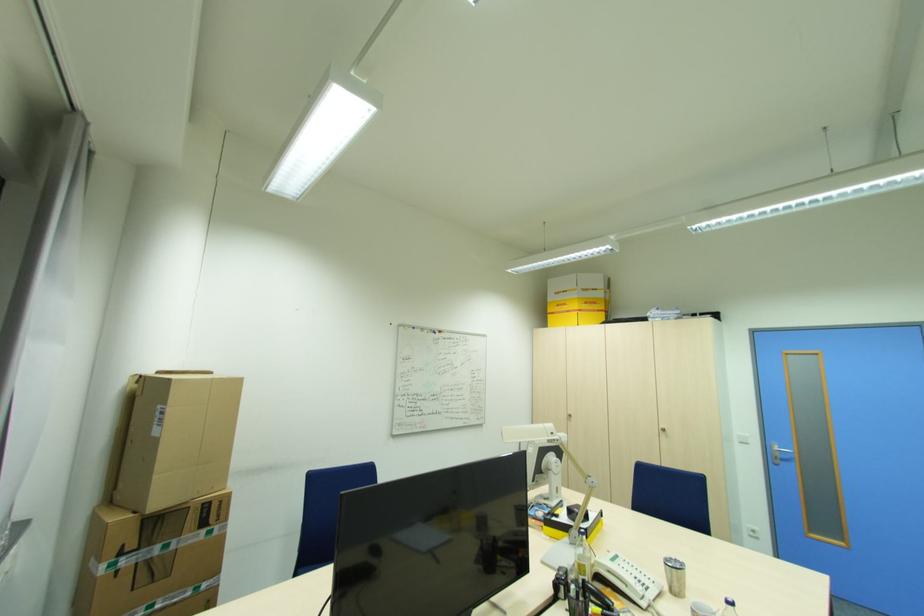
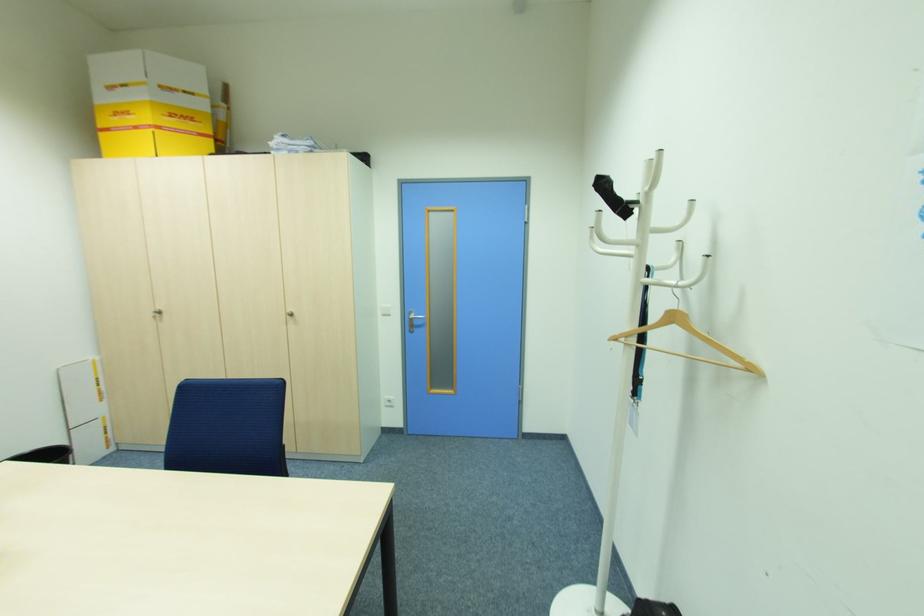
In the second image, find the point that corresponds to the point at 779,458 in the first image.

(415, 325)